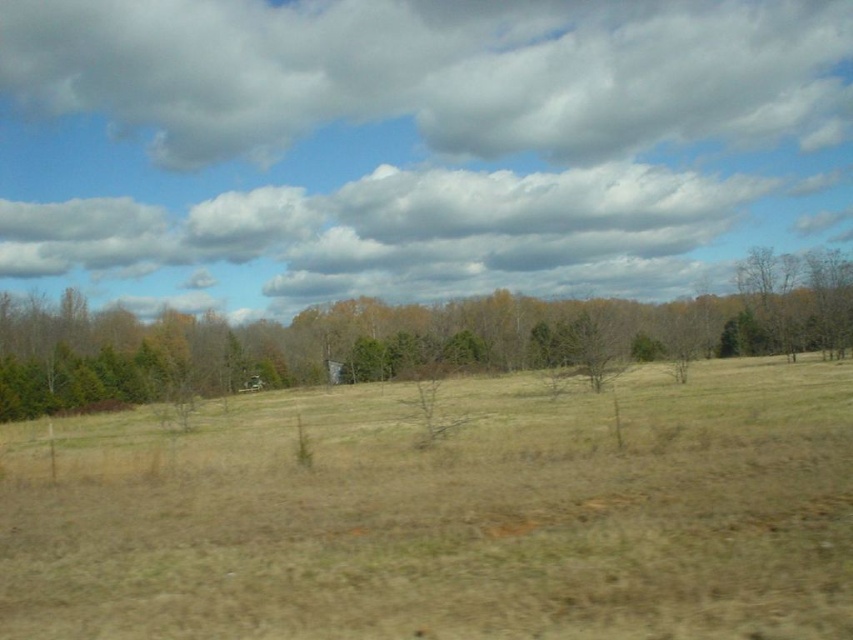
Question: Considering the real-world distances, which object is closest to the green textured tree at center?

Choices:
 (A) transparent glass car window at center
 (B) brown dry grass at center

Answer: (B)

Question: Does brown dry grass at center have a lesser width compared to cloudy sky at upper center?

Choices:
 (A) yes
 (B) no

Answer: (A)

Question: Which point is closer to the camera?

Choices:
 (A) cloudy sky at upper center
 (B) green textured tree at center

Answer: (B)

Question: Does brown dry grass at center have a smaller size compared to transparent glass car window at center?

Choices:
 (A) yes
 (B) no

Answer: (B)

Question: Where is brown dry grass at center located in relation to green textured tree at center in the image?

Choices:
 (A) below
 (B) above

Answer: (A)

Question: Considering the real-world distances, which object is farthest from the cloudy sky at upper center?

Choices:
 (A) green textured tree at center
 (B) transparent glass car window at center

Answer: (B)